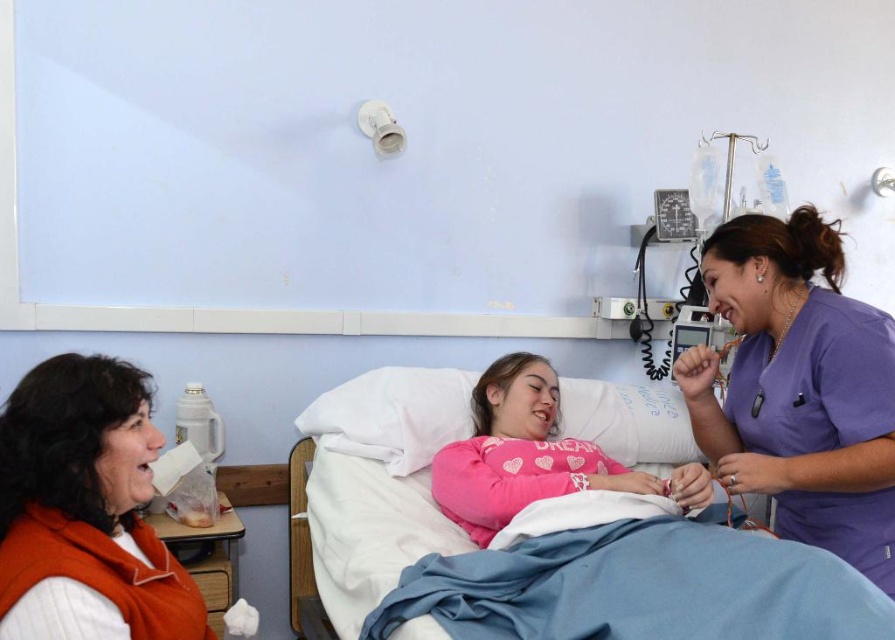
You are a nurse trying to place a medical chart on the bed. The purple scrubs at center and the pink cotton pillow at center are already on the bed. Which object should you move to make more space?

The purple scrubs at center should be moved because it occupies less space than the pink cotton pillow at center, making it easier to relocate to free up more space.

Which object is located at the coordinates point [799,388]?

The purple scrubs at center is located at point [799,388].

You are a nurse in the hospital room. You need to place a tray of medications on a surface between the purple scrubs at center and the orange fleece vest at left. Which side should you place it on to ensure it doesn

The purple scrubs at center is wider than the orange fleece vest at left, so placing the tray on the side of the orange fleece vest at left would leave more space for the medications.